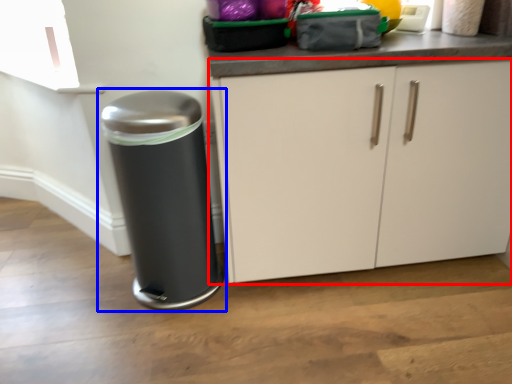
Question: Which point is further to the camera, cabinetry (highlighted by a red box) or waste container (highlighted by a blue box)?

Choices:
 (A) cabinetry
 (B) waste container

Answer: (B)